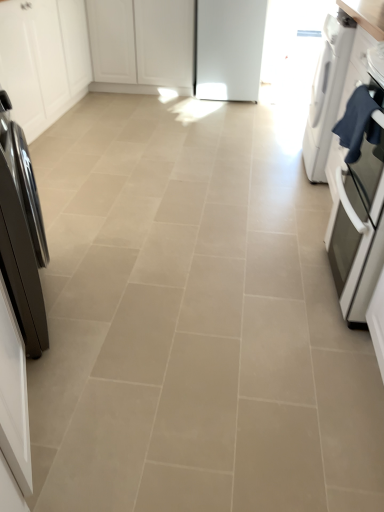
Question: From the image's perspective, is white glossy dryer at right, placed as the second home appliance when sorted from front to back, below shiny black refrigerator at left, which is the first home appliance in bottom-to-top order?

Choices:
 (A) yes
 (B) no

Answer: (B)

Question: Is white glossy dryer at right, positioned as the 1th home appliance in right-to-left order, outside shiny black refrigerator at left, marked as the 2th home appliance in a right-to-left arrangement?

Choices:
 (A) no
 (B) yes

Answer: (B)

Question: From a real-world perspective, is white glossy dryer at right, which is counted as the 2th home appliance, starting from the left, on shiny black refrigerator at left, the 1th home appliance from the left?

Choices:
 (A) no
 (B) yes

Answer: (A)

Question: Does white glossy dryer at right, which is counted as the 2th home appliance, starting from the left, have a smaller size compared to shiny black refrigerator at left, the 1th home appliance from the front?

Choices:
 (A) yes
 (B) no

Answer: (B)

Question: Could you tell me if white glossy dryer at right, positioned as the 1th home appliance in right-to-left order, is facing shiny black refrigerator at left, positioned as the 2th home appliance in top-to-bottom order?

Choices:
 (A) yes
 (B) no

Answer: (B)

Question: Is matte stainless steel oven at right wider or thinner than dark blue fabric at right?

Choices:
 (A) thin
 (B) wide

Answer: (B)

Question: From a real-world perspective, is matte stainless steel oven at right positioned above or below dark blue fabric at right?

Choices:
 (A) above
 (B) below

Answer: (B)

Question: Considering the relative positions of matte stainless steel oven at right and dark blue fabric at right in the image provided, is matte stainless steel oven at right to the left or to the right of dark blue fabric at right?

Choices:
 (A) left
 (B) right

Answer: (B)

Question: Does point (372, 286) appear closer or farther from the camera than point (357, 157)?

Choices:
 (A) farther
 (B) closer

Answer: (B)

Question: Is shiny black refrigerator at left, which is the first home appliance in bottom-to-top order, to the left or to the right of dark blue fabric at right in the image?

Choices:
 (A) left
 (B) right

Answer: (A)

Question: Considering the positions of shiny black refrigerator at left, which is the second home appliance from back to front, and dark blue fabric at right in the image, is shiny black refrigerator at left, which is the second home appliance from back to front, taller or shorter than dark blue fabric at right?

Choices:
 (A) short
 (B) tall

Answer: (B)

Question: Is shiny black refrigerator at left, marked as the 2th home appliance in a right-to-left arrangement, inside or outside of dark blue fabric at right?

Choices:
 (A) inside
 (B) outside

Answer: (B)

Question: Does point (26, 325) appear closer or farther from the camera than point (377, 108)?

Choices:
 (A) farther
 (B) closer

Answer: (A)

Question: From a real-world perspective, is white matte cabinet at upper left, acting as the first cabinetry starting from the left, above or below white matte cabinet at center, the second cabinetry viewed from the left?

Choices:
 (A) above
 (B) below

Answer: (A)

Question: Is white matte cabinet at upper left, the 2th cabinetry from the right, wider or thinner than white matte cabinet at center, the second cabinetry viewed from the left?

Choices:
 (A) thin
 (B) wide

Answer: (A)